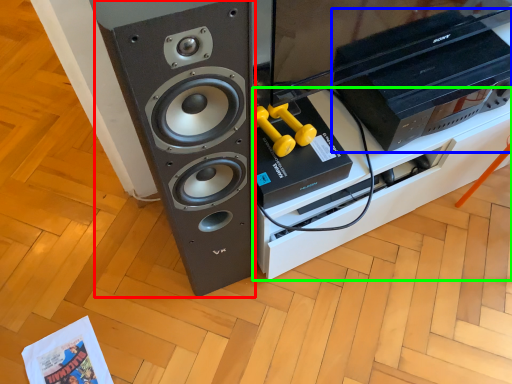
Question: Which is farther away from speaker (highlighted by a red box)? home appliance (highlighted by a blue box) or furniture (highlighted by a green box)?

Choices:
 (A) home appliance
 (B) furniture

Answer: (A)